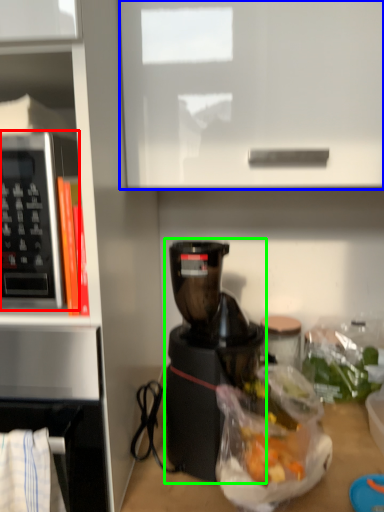
Question: Based on their relative distances, which object is nearer to microwave oven (highlighted by a red box)? Choose from cabinetry (highlighted by a blue box) and coffee maker (highlighted by a green box).

Choices:
 (A) cabinetry
 (B) coffee maker

Answer: (A)